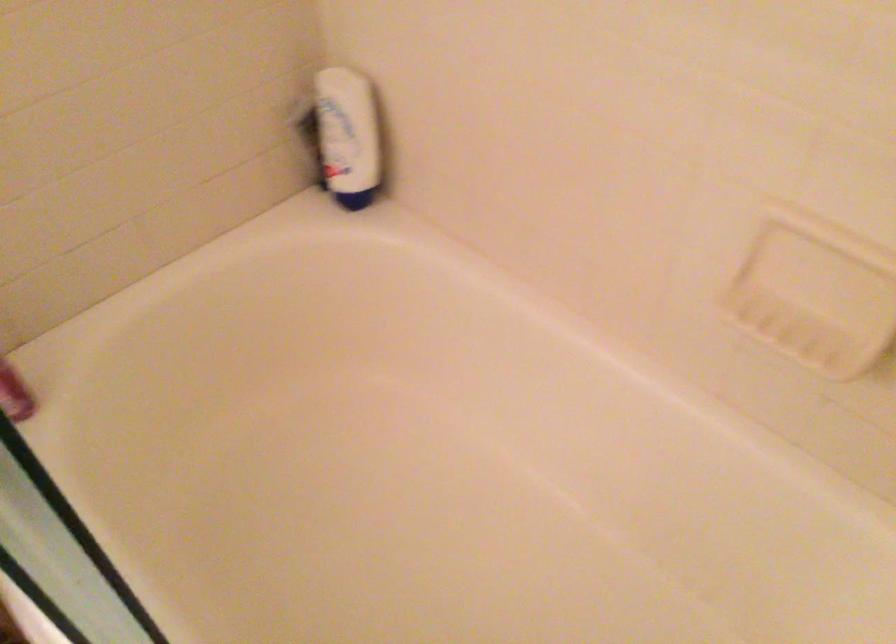
What do you see at coordinates (354, 199) in the screenshot? This screenshot has height=644, width=896. I see `the blue bottle cap` at bounding box center [354, 199].